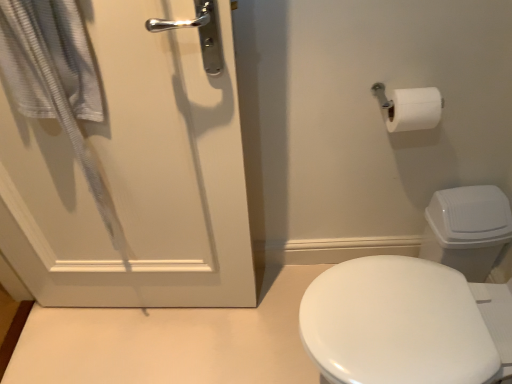
Locate an element on the screen. The width and height of the screenshot is (512, 384). vacant space to the right of white matte door at left is located at coordinates click(x=240, y=328).